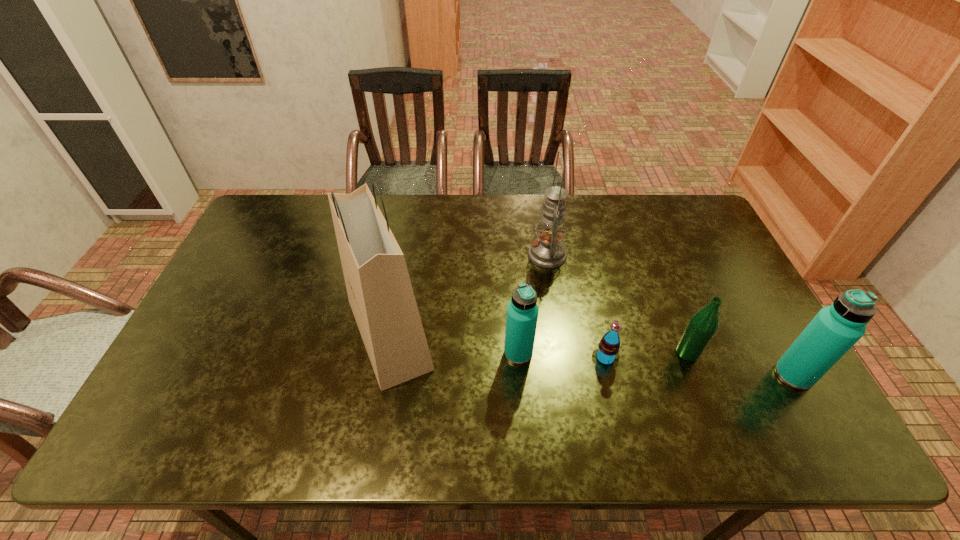
You are a GUI agent. You are given a task and a screenshot of the screen. Output one action in this format:
    pyautogui.click(x=<x>, y=<y>)
    Task: Click on the empty space that is in between the shopping bag and the right water bottle
    The height and width of the screenshot is (540, 960).
    Given the screenshot: What is the action you would take?
    pos(591,354)

This screenshot has width=960, height=540. I want to click on empty space between the fifth tallest object and the rightmost object, so click(741, 363).

Where is `vacant area that lies between the fifth object from left to right and the fourth object from left to right`? vacant area that lies between the fifth object from left to right and the fourth object from left to right is located at coordinates (646, 355).

Where is `free space between the tallest object and the third tallest object`? This screenshot has width=960, height=540. free space between the tallest object and the third tallest object is located at coordinates (591, 354).

The image size is (960, 540). What are the coordinates of `vacant area between the rightmost object and the shopping bag` in the screenshot? It's located at (591, 354).

Locate an element on the screen. object that stands as the closest to the soda is located at coordinates (522, 311).

Locate an element on the screen. The image size is (960, 540). the closest object to the shortest object is located at coordinates (522, 311).

At what (x,y) coordinates should I click in order to perform the action: click on blank space that satisfies the following two spatial constraints: 1. on the back side of the left water bottle; 2. on the right side of the fourth object from right to left. Please return your answer as a coordinate pair (x, y). This screenshot has width=960, height=540. Looking at the image, I should click on (512, 255).

What are the coordinates of `free space in the image that satisfies the following two spatial constraints: 1. on the back side of the shorter water bottle; 2. on the left side of the fourth object from right to left` in the screenshot? It's located at [x=512, y=255].

Locate an element on the screen. The image size is (960, 540). vacant point that satisfies the following two spatial constraints: 1. on the front side of the rightmost object; 2. on the right side of the oil lamp is located at coordinates (565, 375).